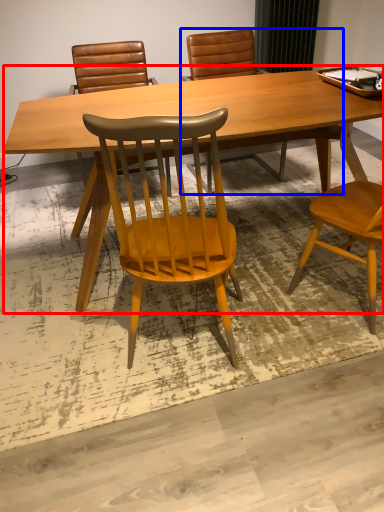
Question: Among these objects, which one is farthest to the camera, desk (highlighted by a red box) or chair (highlighted by a blue box)?

Choices:
 (A) desk
 (B) chair

Answer: (B)